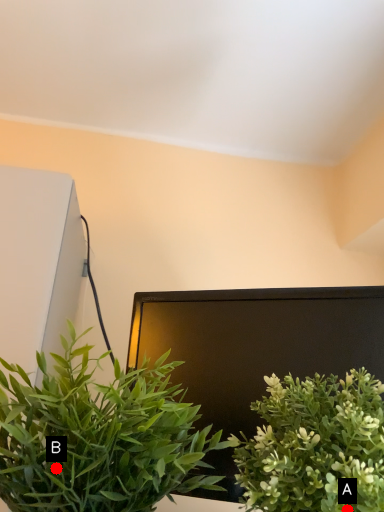
Question: Two points are circled on the image, labeled by A and B beside each circle. Which point is closer to the camera taking this photo?

Choices:
 (A) A is closer
 (B) B is closer

Answer: (B)